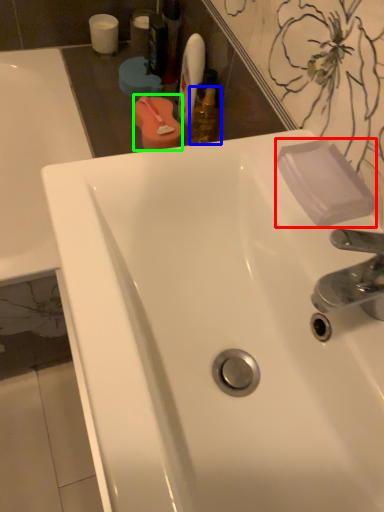
Question: Estimate the real-world distances between objects in this image. Which object is closer to soap (highlighted by a red box), mouthwash (highlighted by a blue box) or mouthwash (highlighted by a green box)?

Choices:
 (A) mouthwash
 (B) mouthwash

Answer: (A)